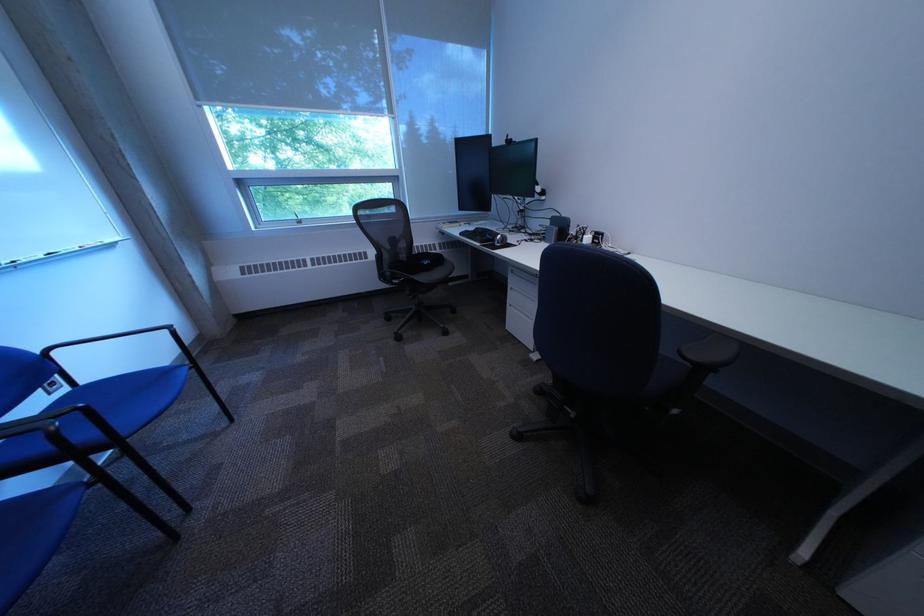
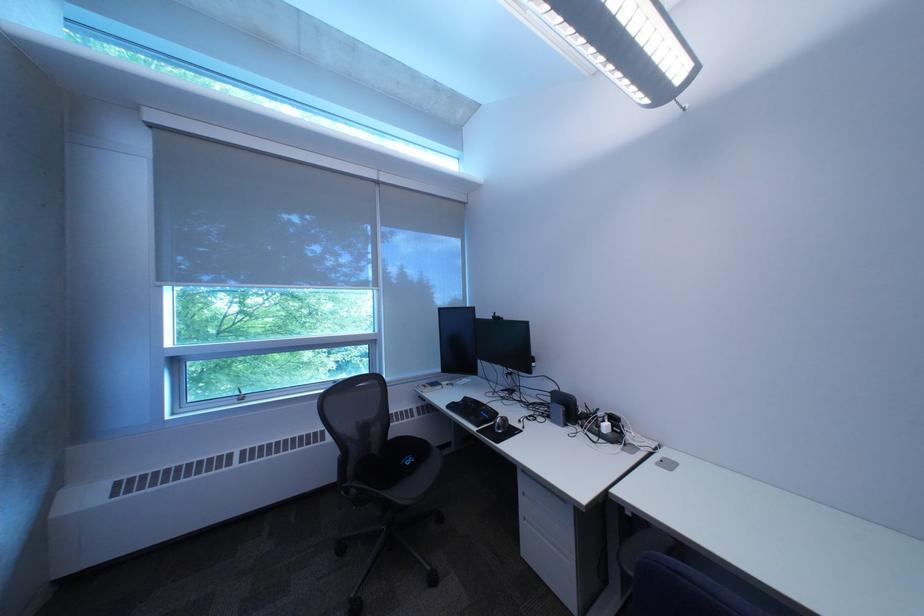
In the second image, find the point that corresponds to (x=477, y=236) in the first image.

(464, 408)